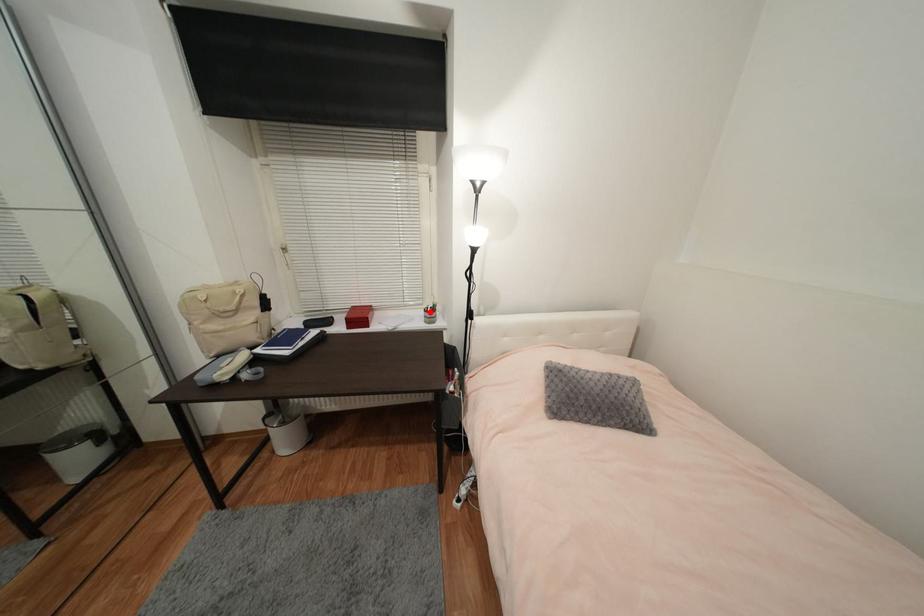
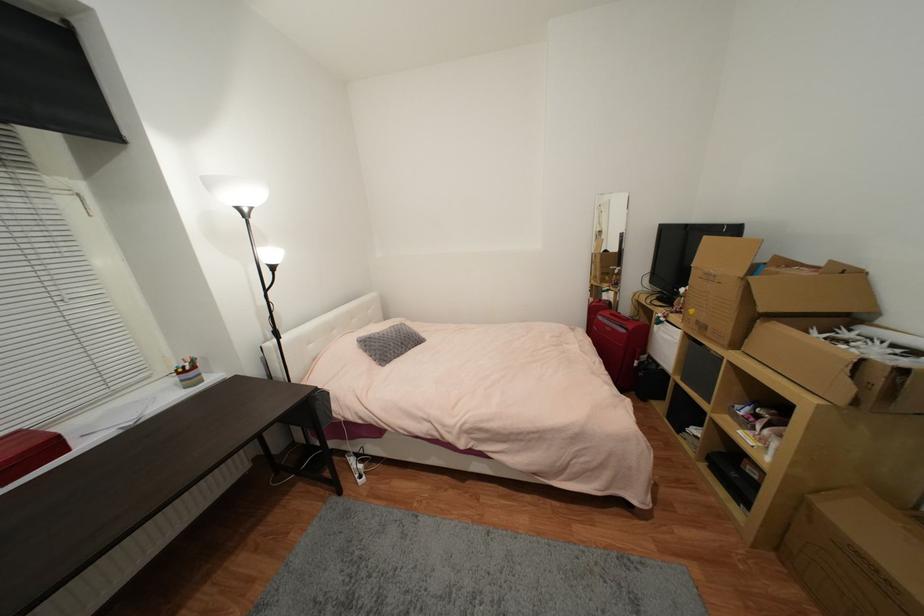
Find the pixel in the second image that matches the highlighted location in the first image.

(185, 374)